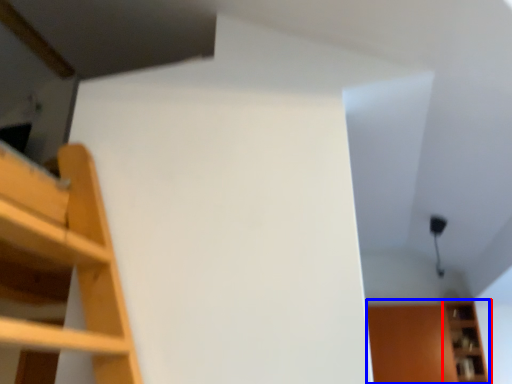
Question: Among these objects, which one is nearest to the camera, shelf (highlighted by a red box) or cabinet (highlighted by a blue box)?

Choices:
 (A) shelf
 (B) cabinet

Answer: (A)